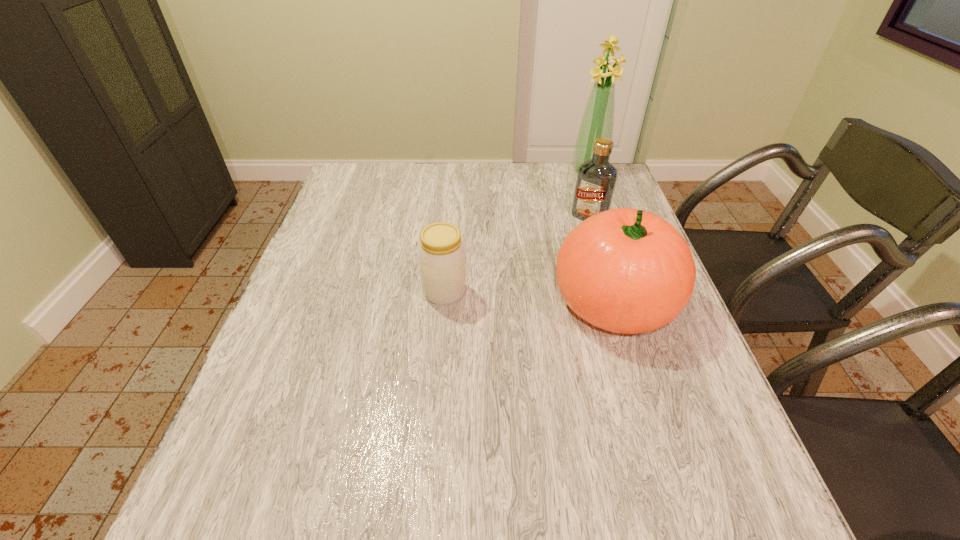
Locate which object ranks second in proximity to the tallest object. Please provide its 2D coordinates. Your answer should be formatted as a tuple, i.e. [(x, y)], where the tuple contains the x and y coordinates of a point satisfying the conditions above.

[(624, 270)]

Image resolution: width=960 pixels, height=540 pixels. What are the coordinates of `vacant region that satisfies the following two spatial constraints: 1. on the back side of the bouquet; 2. on the left side of the third nearest object` in the screenshot? It's located at (575, 171).

You are a GUI agent. You are given a task and a screenshot of the screen. Output one action in this format:
    pyautogui.click(x=<x>, y=<y>)
    Task: Click on the vacant space that satisfies the following two spatial constraints: 1. on the back side of the farthest object; 2. on the right side of the leftmost object
    The width and height of the screenshot is (960, 540).
    Given the screenshot: What is the action you would take?
    pyautogui.click(x=455, y=171)